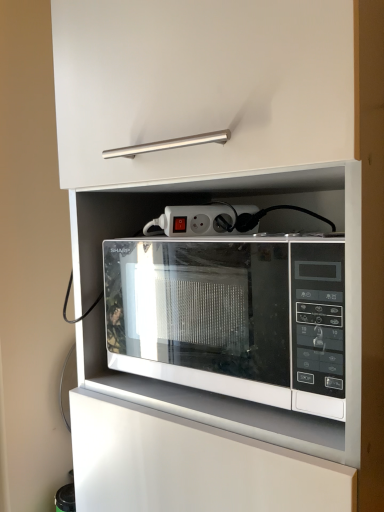
Question: Is white glossy microwave at center next to white plastic power strip at center?

Choices:
 (A) yes
 (B) no

Answer: (B)

Question: Considering the relative sizes of white glossy microwave at center and white plastic power strip at center in the image provided, is white glossy microwave at center smaller than white plastic power strip at center?

Choices:
 (A) no
 (B) yes

Answer: (A)

Question: Does white glossy microwave at center lie in front of white plastic power strip at center?

Choices:
 (A) no
 (B) yes

Answer: (B)

Question: From a real-world perspective, is white glossy microwave at center below white plastic power strip at center?

Choices:
 (A) no
 (B) yes

Answer: (B)

Question: From a real-world perspective, is white glossy microwave at center on white plastic power strip at center?

Choices:
 (A) yes
 (B) no

Answer: (B)

Question: Is white glossy microwave at center to the right of white plastic power strip at center from the viewer's perspective?

Choices:
 (A) yes
 (B) no

Answer: (A)

Question: Can you confirm if white plastic power strip at center is shorter than white glossy microwave at center?

Choices:
 (A) yes
 (B) no

Answer: (A)

Question: Can you confirm if white plastic power strip at center is bigger than white glossy microwave at center?

Choices:
 (A) yes
 (B) no

Answer: (B)

Question: From a real-world perspective, is white plastic power strip at center on top of white glossy microwave at center?

Choices:
 (A) no
 (B) yes

Answer: (B)

Question: From a real-world perspective, is white plastic power strip at center located beneath white glossy microwave at center?

Choices:
 (A) yes
 (B) no

Answer: (B)

Question: From the image's perspective, does white plastic power strip at center appear higher than white glossy microwave at center?

Choices:
 (A) no
 (B) yes

Answer: (B)

Question: Can you see white plastic power strip at center touching white glossy microwave at center?

Choices:
 (A) no
 (B) yes

Answer: (A)

Question: Is white plastic power strip at center bigger or smaller than white glossy microwave at center?

Choices:
 (A) big
 (B) small

Answer: (B)